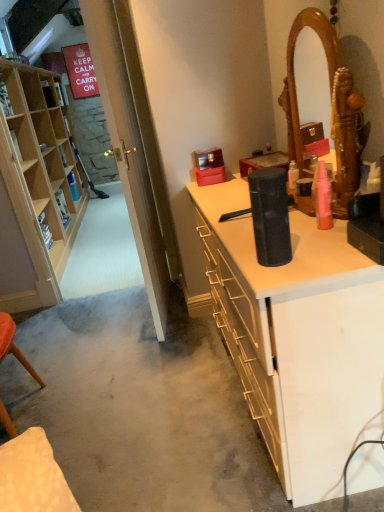
Where is `empty space that is ontop of black matte speaker at center (from a real-world perspective)`? This screenshot has height=512, width=384. empty space that is ontop of black matte speaker at center (from a real-world perspective) is located at coordinates (242, 204).